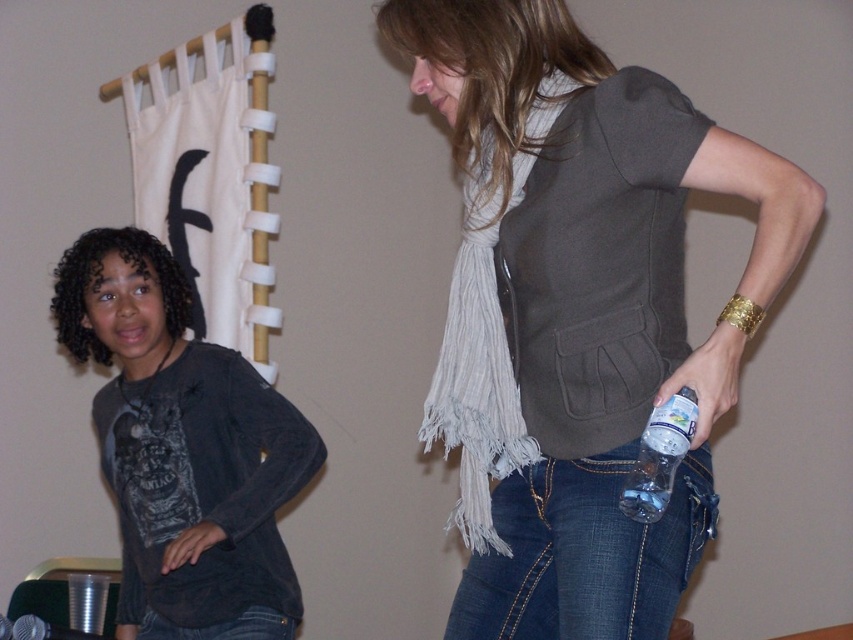
You are taking a photo of two people in a room. You notice two points in the image labeled as point 1 and point 2. Point 1 is at coordinate (140, 538) and point 2 is at coordinate (590, 481). If you want to focus on the point that is closer to the camera, which point should you choose?

Point 1 at coordinate (140, 538) is closer to the camera than point 2 at coordinate (590, 481). Therefore, you should choose point 1 to focus on.

Based on the coordinates provided, which object corresponds to the point at location (x=181, y=440)?

The point at location (x=181, y=440) corresponds to the dark gray cotton shirt at center.

You are a photographer standing in the scene and want to take a closeup shot of the dark gray cotton shirt at center without moving any objects. Can you reach it with your camera that has a maximum focus distance of 1.5 meters?

The dark gray cotton shirt at center and viewer are 1.71 meters apart, which is beyond the camera maximum focus distance of 1.5 meters. You cannot take the closeup shot without moving closer.